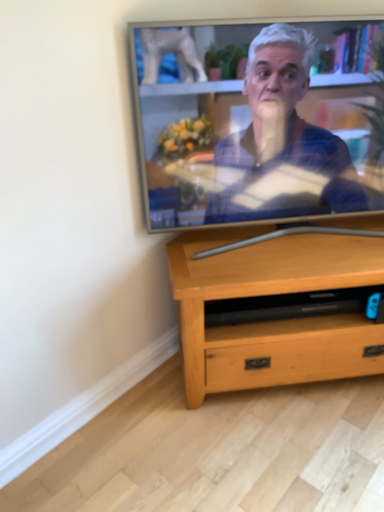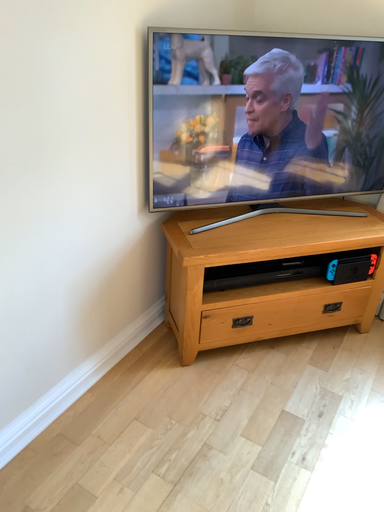
Question: How did the camera likely rotate when shooting the video?

Choices:
 (A) rotated left
 (B) rotated right

Answer: (B)